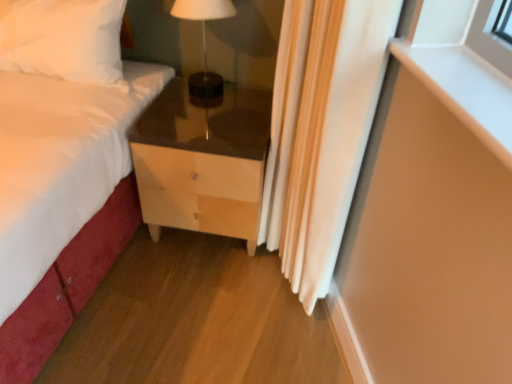
You are a GUI agent. You are given a task and a screenshot of the screen. Output one action in this format:
    pyautogui.click(x=<x>, y=<y>)
    Task: Click on the blank area beneath white fabric curtain at right (from a real-world perspective)
    
    Given the screenshot: What is the action you would take?
    pyautogui.click(x=278, y=284)